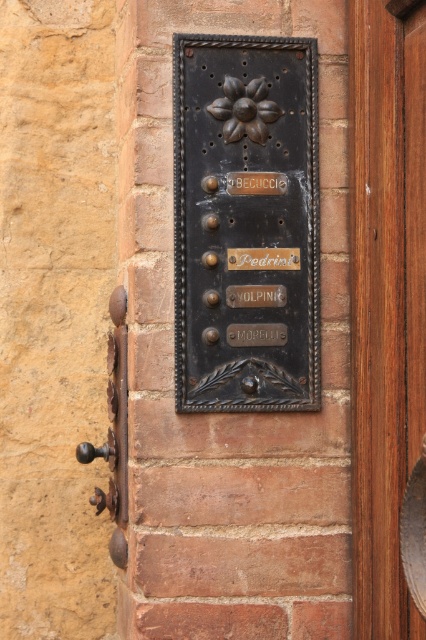
Which is above, brown wooden door at right or rusty metal door handle at left?

brown wooden door at right is above.

Can you confirm if brown wooden door at right is positioned above rusty metal door handle at left?

Yes, brown wooden door at right is above rusty metal door handle at left.

Identify the location of brown wooden door at right. (385, 298).

Find the location of a particular element. brown wooden door at right is located at coordinates (385, 298).

Does point (267, 164) lie in front of point (371, 289)?

No, (267, 164) is further to viewer.

Which is behind, point (221, 266) or point (377, 58)?

The point (221, 266) is more distant.

Image resolution: width=426 pixels, height=640 pixels. What are the coordinates of `matte black plaque at center` in the screenshot? It's located at (245, 224).

Does matte black plaque at center appear under rusty metal door handle at left?

No.

Can you confirm if matte black plaque at center is shorter than rusty metal door handle at left?

In fact, matte black plaque at center may be taller than rusty metal door handle at left.

This screenshot has width=426, height=640. Identify the location of matte black plaque at center. (245, 224).